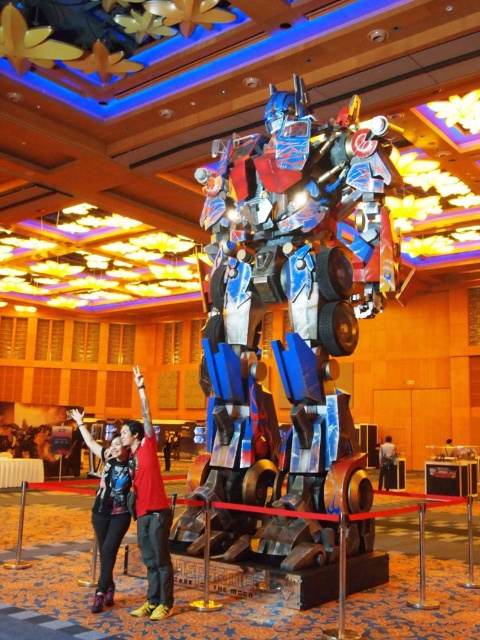
Who is positioned more to the right, red shirt at center or metallic red shirt at center?

From the viewer's perspective, red shirt at center appears more on the right side.

What are the coordinates of `red shirt at center` in the screenshot? It's located at (149, 509).

Is point (168, 604) positioned before point (167, 460)?

Yes, point (168, 604) is closer to viewer.

The width and height of the screenshot is (480, 640). Find the location of `red shirt at center`. red shirt at center is located at coordinates (149, 509).

Does red shirt at center have a greater height compared to matte black jacket at lower left?

No, red shirt at center is not taller than matte black jacket at lower left.

Locate an element on the screen. The height and width of the screenshot is (640, 480). red shirt at center is located at coordinates (149, 509).

What do you see at coordinates (108, 506) in the screenshot? I see `matte black jacket at lower left` at bounding box center [108, 506].

Is matte black jacket at lower left shorter than metallic silver suit at center?

In fact, matte black jacket at lower left may be taller than metallic silver suit at center.

Is point (85, 428) farther from camera compared to point (386, 467)?

No.

Identify the location of matte black jacket at lower left. The image size is (480, 640). (108, 506).